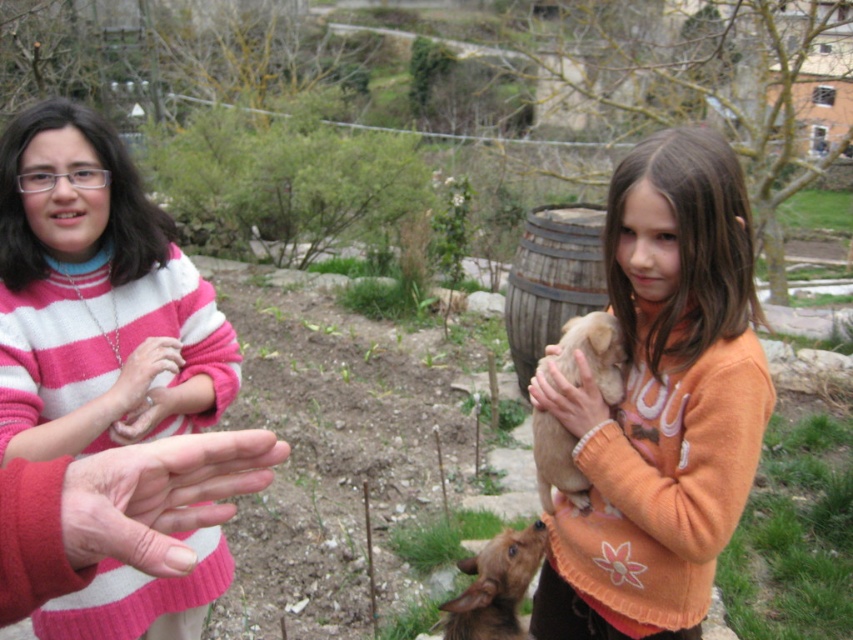
Question: Which point is farther to the camera?

Choices:
 (A) orange fleece sweater at center
 (B) pink striped sweater at left
 (C) soft beige fur at center
 (D) light brown fur at center

Answer: (D)

Question: Does orange fleece sweater at center have a smaller size compared to pink striped sweater at left?

Choices:
 (A) yes
 (B) no

Answer: (B)

Question: Is brown furry dog at lower center in front of soft beige fur at center?

Choices:
 (A) yes
 (B) no

Answer: (B)

Question: Among these objects, which one is nearest to the camera?

Choices:
 (A) pink matte hand at center
 (B) brown furry dog at lower center

Answer: (A)

Question: Does matte pink sweater at upper left have a lesser width compared to matte pink sweater at left?

Choices:
 (A) no
 (B) yes

Answer: (A)

Question: Which object is positioned farthest from the brown furry dog at lower center?

Choices:
 (A) soft beige fur at center
 (B) light brown fur at center

Answer: (A)